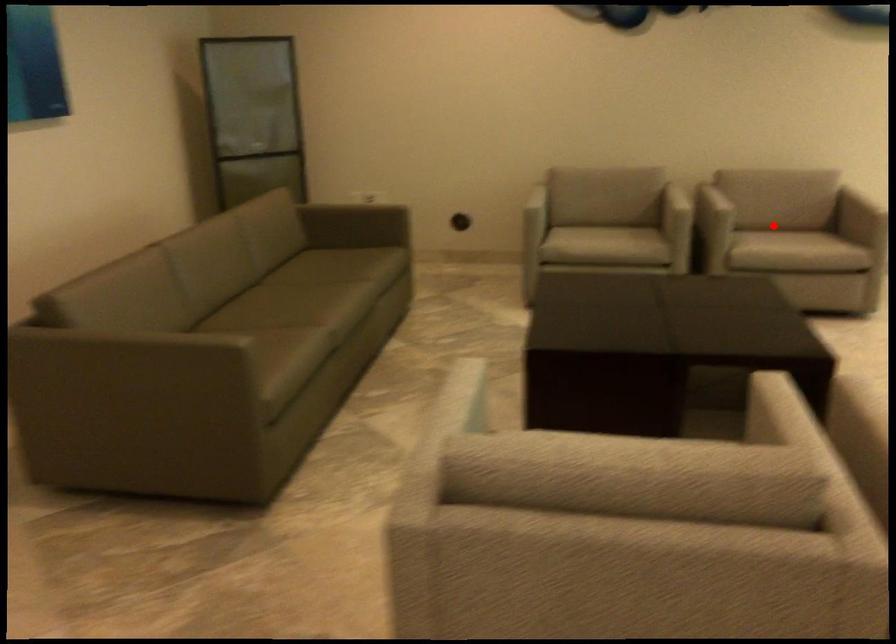
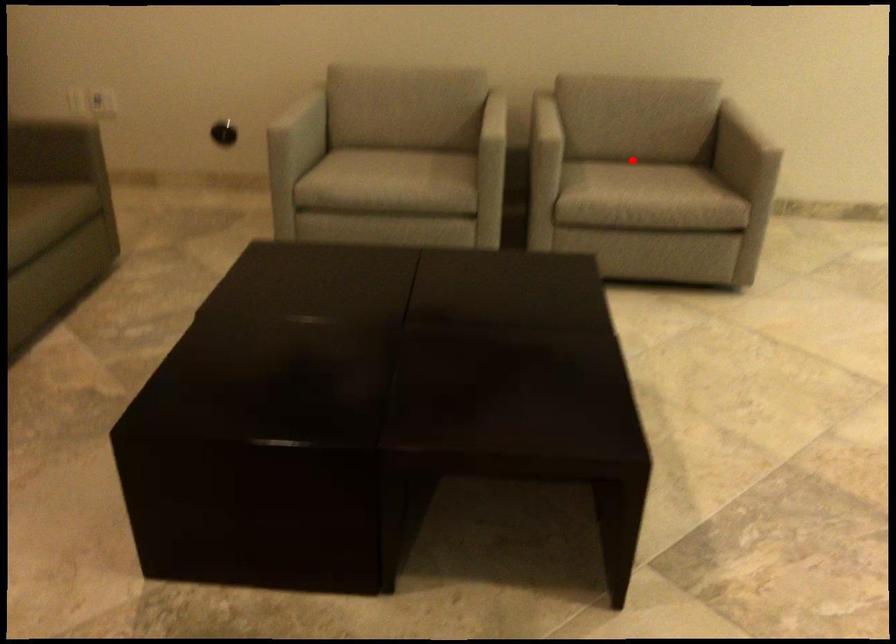
I am providing you with two images of the same scene from different viewpoints. A red point is marked on the first image and another point is marked on the second image. Is the marked point in image1 the same physical position as the marked point in image2?

Yes